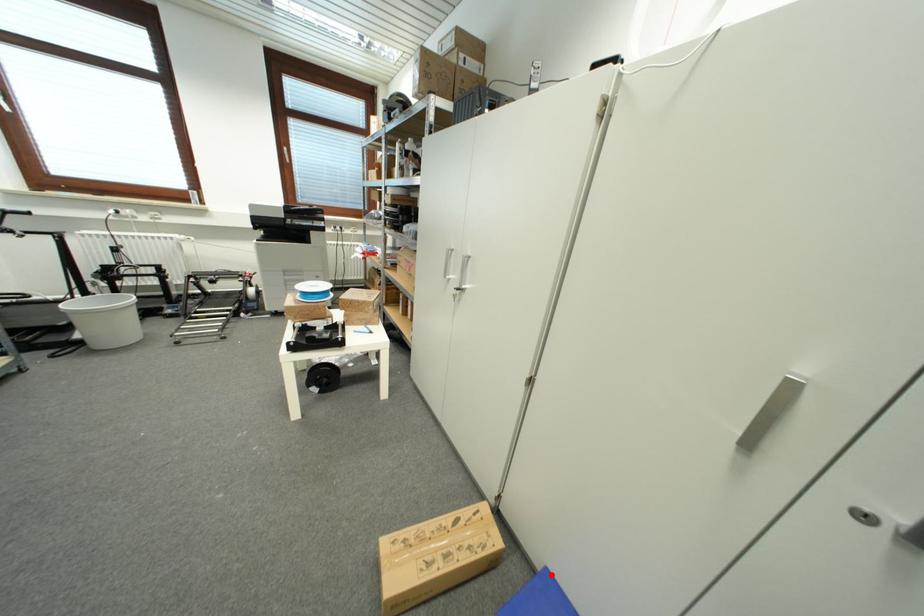
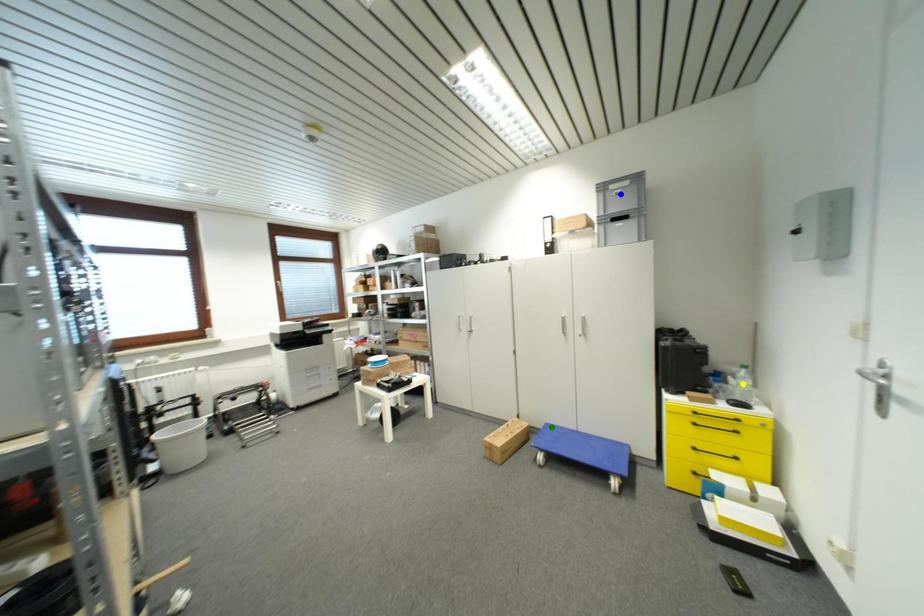
Question: I am providing you with two images of the same scene from different viewpoints. A red point is marked on the first image. You are given multiple points on the second image. Which spot in image 2 lines up with the point in image 1?

Choices:
 (A) green point
 (B) blue point
 (C) yellow point

Answer: (A)